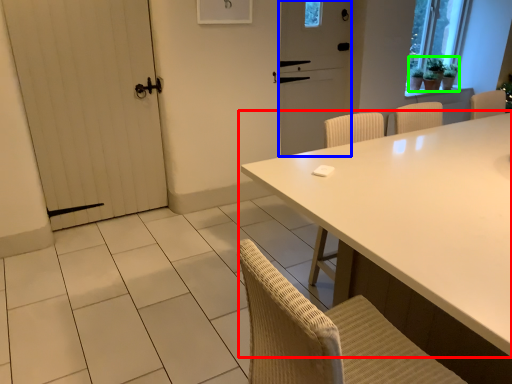
Question: Considering the real-world distances, which object is farthest from table (highlighted by a red box)? screen door (highlighted by a blue box) or plant (highlighted by a green box)?

Choices:
 (A) screen door
 (B) plant

Answer: (B)